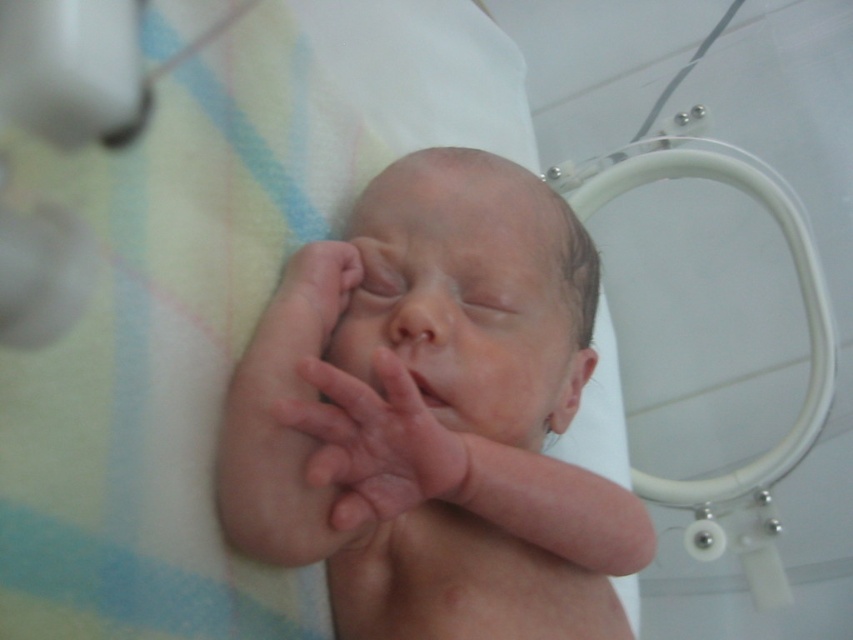
Who is more forward, (x=437, y=276) or (x=352, y=378)?

Positioned in front is point (x=352, y=378).

Between smooth skin baby at center and pink smooth skin at center, which one has more height?

Standing taller between the two is smooth skin baby at center.

The image size is (853, 640). Find the location of `smooth skin baby at center`. smooth skin baby at center is located at coordinates (433, 416).